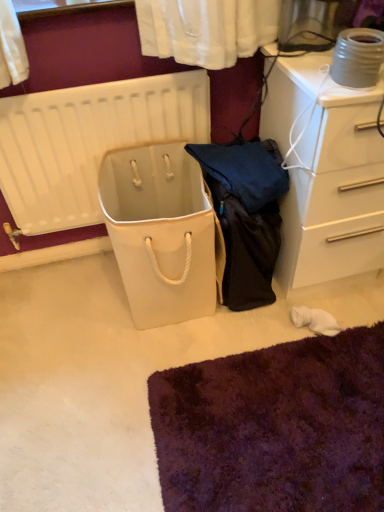
Question: From the image's perspective, is white matte radiator at left above or below white glossy chest of drawers at upper right?

Choices:
 (A) above
 (B) below

Answer: (B)

Question: Does point (152, 81) appear closer or farther from the camera than point (375, 144)?

Choices:
 (A) farther
 (B) closer

Answer: (A)

Question: Relative to white glossy chest of drawers at upper right, is white matte radiator at left in front or behind?

Choices:
 (A) behind
 (B) front

Answer: (A)

Question: In terms of size, does white glossy chest of drawers at upper right appear bigger or smaller than white matte radiator at left?

Choices:
 (A) big
 (B) small

Answer: (A)

Question: From the image's perspective, is white glossy chest of drawers at upper right above or below white matte radiator at left?

Choices:
 (A) below
 (B) above

Answer: (B)

Question: From a real-world perspective, is white glossy chest of drawers at upper right physically located above or below white matte radiator at left?

Choices:
 (A) below
 (B) above

Answer: (A)

Question: Is white glossy chest of drawers at upper right in front of or behind white matte radiator at left in the image?

Choices:
 (A) front
 (B) behind

Answer: (A)